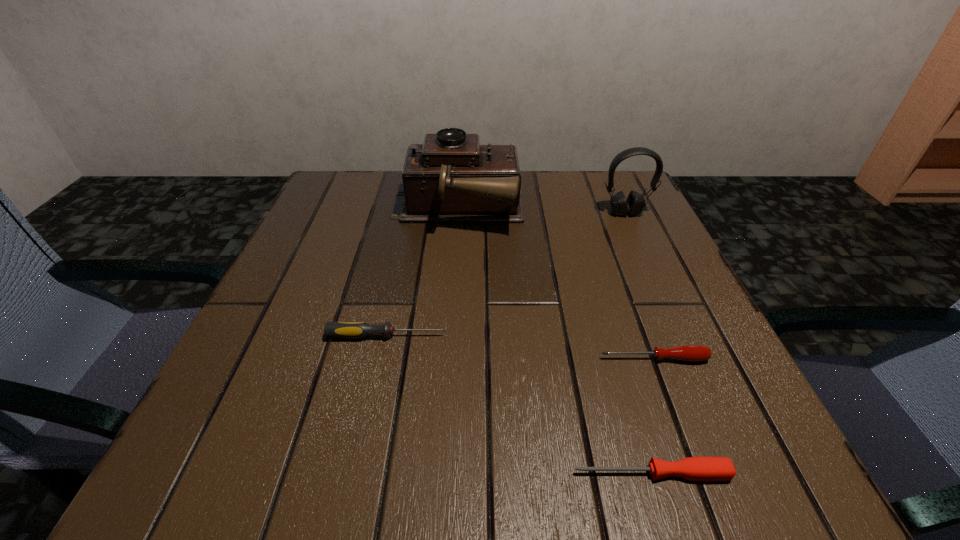
At what (x,y) coordinates should I click in order to perform the action: click on vacant area at the far edge of the desktop. Please return your answer as a coordinate pair (x, y). The height and width of the screenshot is (540, 960). Looking at the image, I should click on (550, 180).

Where is `free point at the left edge`? The image size is (960, 540). free point at the left edge is located at coordinates (355, 257).

Find the location of a particular element. Image resolution: width=960 pixels, height=540 pixels. blank area at the right edge is located at coordinates (690, 296).

This screenshot has width=960, height=540. In the image, there is a desktop. Identify the location of vacant region at the far left corner. (376, 179).

Find the location of a particular element. The image size is (960, 540). free space at the near left corner of the desktop is located at coordinates (286, 439).

Where is `blank space at the far right corner of the desktop`? This screenshot has width=960, height=540. blank space at the far right corner of the desktop is located at coordinates (574, 176).

The width and height of the screenshot is (960, 540). I want to click on free spot between the headset and the nearest object, so click(638, 343).

Identify the location of free space between the leftmost screwdriver and the nearest screwdriver. (519, 404).

You are a GUI agent. You are given a task and a screenshot of the screen. Output one action in this format:
    pyautogui.click(x=<x>, y=<y>)
    Task: Click on the vacant region between the headset and the nearest object
    This screenshot has width=960, height=540.
    Given the screenshot: What is the action you would take?
    pyautogui.click(x=638, y=343)

The width and height of the screenshot is (960, 540). In order to click on vacant space in between the nearest screwdriver and the headset in this screenshot , I will do `click(638, 343)`.